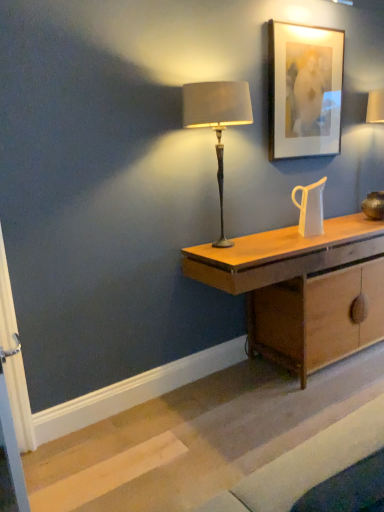
From the picture: Measure the distance between wooden desk at center and camera.

wooden desk at center is 2.12 meters from camera.

Where is `matte beige fabric lampshade at center`? matte beige fabric lampshade at center is located at coordinates tap(217, 120).

What do you see at coordinates (304, 90) in the screenshot?
I see `matte wooden picture frame at upper right` at bounding box center [304, 90].

The height and width of the screenshot is (512, 384). In order to click on matte wooden picture frame at upper right in this screenshot , I will do `click(304, 90)`.

You are a GUI agent. You are given a task and a screenshot of the screen. Output one action in this format:
    pyautogui.click(x=<x>, y=<y>)
    Task: Click on the transparent glass jug at center
    Image resolution: width=384 pixels, height=512 pixels.
    Given the screenshot: What is the action you would take?
    coord(310,208)

Does point (320, 190) appear closer or farther from the camera than point (261, 266)?

Point (320, 190) is farther from the camera than point (261, 266).

From the image's perspective, is transparent glass jug at center on top of wooden desk at center?

Yes.

Where is `desk in front of the transparent glass jug at center`? The width and height of the screenshot is (384, 512). desk in front of the transparent glass jug at center is located at coordinates (283, 258).

Could you tell me if transparent glass jug at center is facing wooden desk at center?

No, transparent glass jug at center is not facing towards wooden desk at center.

Is wooden desk at center smaller than matte wooden picture frame at upper right?

No.

Does wooden desk at center turn towards matte wooden picture frame at upper right?

No, wooden desk at center is not aimed at matte wooden picture frame at upper right.

Can we say wooden desk at center lies outside matte wooden picture frame at upper right?

wooden desk at center is positioned outside matte wooden picture frame at upper right.

Consider the image. Which object is positioned more to the right, wooden desk at center or matte wooden picture frame at upper right?

wooden desk at center is more to the right.

Locate an element on the screen. picture frame that appears on the right of transparent glass jug at center is located at coordinates (304, 90).

Which is in front, point (307, 226) or point (324, 154)?

The point (307, 226) is closer.

Is transparent glass jug at center completely or partially outside of matte wooden picture frame at upper right?

That's correct, transparent glass jug at center is outside of matte wooden picture frame at upper right.

Is transparent glass jug at center smaller than matte wooden picture frame at upper right?

Indeed, transparent glass jug at center has a smaller size compared to matte wooden picture frame at upper right.

From the image's perspective, which object appears higher, matte beige fabric lampshade at center or wooden desk at center?

matte beige fabric lampshade at center is shown above in the image.

Between matte beige fabric lampshade at center and wooden desk at center, which one has more height?

matte beige fabric lampshade at center.

Which is in front, matte beige fabric lampshade at center or wooden desk at center?

matte beige fabric lampshade at center is more forward.

Which is more to the left, matte beige fabric lampshade at center or wooden desk at center?

matte beige fabric lampshade at center.

Locate an element on the screen. The height and width of the screenshot is (512, 384). lamp on the left of transparent glass jug at center is located at coordinates (217, 120).

Are matte beige fabric lampshade at center and transparent glass jug at center far apart?

matte beige fabric lampshade at center is near transparent glass jug at center, not far away.

Which object is wider, matte beige fabric lampshade at center or transparent glass jug at center?

matte beige fabric lampshade at center.

Would you say matte beige fabric lampshade at center contains transparent glass jug at center?

No, matte beige fabric lampshade at center does not contain transparent glass jug at center.

Considering the relative sizes of matte beige fabric lampshade at center and matte wooden picture frame at upper right in the image provided, is matte beige fabric lampshade at center thinner than matte wooden picture frame at upper right?

No.

From a real-world perspective, between matte beige fabric lampshade at center and matte wooden picture frame at upper right, who is vertically lower?

From a 3D spatial view, matte beige fabric lampshade at center is below.

There is a matte beige fabric lampshade at center. Where is `picture frame above it (from a real-world perspective)`? Image resolution: width=384 pixels, height=512 pixels. picture frame above it (from a real-world perspective) is located at coordinates (304, 90).

Between matte beige fabric lampshade at center and matte wooden picture frame at upper right, which one has less height?

Standing shorter between the two is matte wooden picture frame at upper right.

Can you confirm if transparent glass jug at center is taller than matte beige fabric lampshade at center?

No, transparent glass jug at center is not taller than matte beige fabric lampshade at center.

From a real-world perspective, which object stands above the other?

From a 3D spatial view, matte beige fabric lampshade at center is above.

Does point (322, 213) appear closer or farther from the camera than point (218, 114)?

Clearly, point (322, 213) is more distant from the camera than point (218, 114).

From the image's perspective, which is above, transparent glass jug at center or matte beige fabric lampshade at center?

matte beige fabric lampshade at center, from the image's perspective.

Find the location of a particular element. This screenshot has height=512, width=384. desk below the transparent glass jug at center (from the image's perspective) is located at coordinates coord(283,258).

This screenshot has width=384, height=512. Identify the location of picture frame lying behind the wooden desk at center. (304, 90).

Based on their spatial positions, is matte beige fabric lampshade at center or matte wooden picture frame at upper right closer to transparent glass jug at center?

The object closer to transparent glass jug at center is matte wooden picture frame at upper right.

Which object lies nearer to the anchor point matte wooden picture frame at upper right, wooden desk at center or matte beige fabric lampshade at center?

Based on the image, matte beige fabric lampshade at center appears to be nearer to matte wooden picture frame at upper right.

From the image, which object appears to be nearer to matte beige fabric lampshade at center, wooden desk at center or matte wooden picture frame at upper right?

wooden desk at center is positioned closer to the anchor matte beige fabric lampshade at center.

When comparing their distances from wooden desk at center, does matte wooden picture frame at upper right or matte beige fabric lampshade at center seem closer?

The object closer to wooden desk at center is matte beige fabric lampshade at center.

Looking at the image, which one is located closer to matte beige fabric lampshade at center, matte wooden picture frame at upper right or transparent glass jug at center?

The object closer to matte beige fabric lampshade at center is transparent glass jug at center.

Which object lies nearer to the anchor point matte wooden picture frame at upper right, matte beige fabric lampshade at center or wooden desk at center?

matte beige fabric lampshade at center.

Which object lies further to the anchor point wooden desk at center, matte beige fabric lampshade at center or transparent glass jug at center?

matte beige fabric lampshade at center is further to wooden desk at center.

From the image, which object appears to be nearer to transparent glass jug at center, matte wooden picture frame at upper right or wooden desk at center?

The object closer to transparent glass jug at center is wooden desk at center.

Where is `lamp between matte wooden picture frame at upper right and transparent glass jug at center in the vertical direction`? The image size is (384, 512). lamp between matte wooden picture frame at upper right and transparent glass jug at center in the vertical direction is located at coordinates (217, 120).

Locate an element on the screen. jug between matte beige fabric lampshade at center and wooden desk at center is located at coordinates (310, 208).

At what (x,y) coordinates should I click in order to perform the action: click on lamp between matte wooden picture frame at upper right and wooden desk at center in the vertical direction. Please return your answer as a coordinate pair (x, y). This screenshot has height=512, width=384. Looking at the image, I should click on (217, 120).

The height and width of the screenshot is (512, 384). In order to click on jug between matte wooden picture frame at upper right and wooden desk at center vertically in this screenshot , I will do `click(310, 208)`.